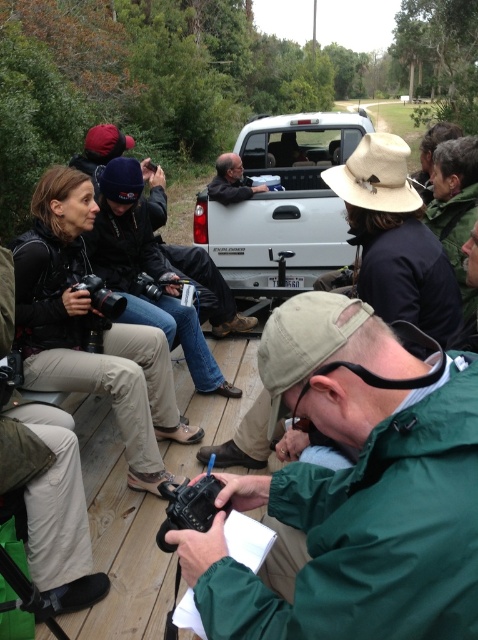
Is green matte jacket at lower right to the left of black matte camera at lower left from the viewer's perspective?

No, green matte jacket at lower right is not to the left of black matte camera at lower left.

Does point (477, 429) come farther from viewer compared to point (109, 304)?

No, it is not.

At what (x,y) coordinates should I click in order to perform the action: click on green matte jacket at lower right. Please return your answer as a coordinate pair (x, y). The width and height of the screenshot is (478, 640). Looking at the image, I should click on (354, 490).

Who is more forward, (345, 406) or (237, 168)?

Point (345, 406)

Does green matte jacket at lower right appear over matte black shirt at center?

No, green matte jacket at lower right is not above matte black shirt at center.

Measure the distance between point [284,401] and camera.

Point [284,401] and camera are 37.75 inches apart from each other.

You are a GUI agent. You are given a task and a screenshot of the screen. Output one action in this format:
    pyautogui.click(x=<x>, y=<y>)
    Task: Click on the green matte jacket at lower right
    
    Given the screenshot: What is the action you would take?
    pyautogui.click(x=354, y=490)

Is white matte truck at center bigger than black matte camera at lower left?

Yes.

Describe the element at coordinates (282, 204) in the screenshot. I see `white matte truck at center` at that location.

Measure the distance between white matte truck at center and camera.

4.43 meters

Image resolution: width=478 pixels, height=640 pixels. I want to click on white matte truck at center, so click(282, 204).